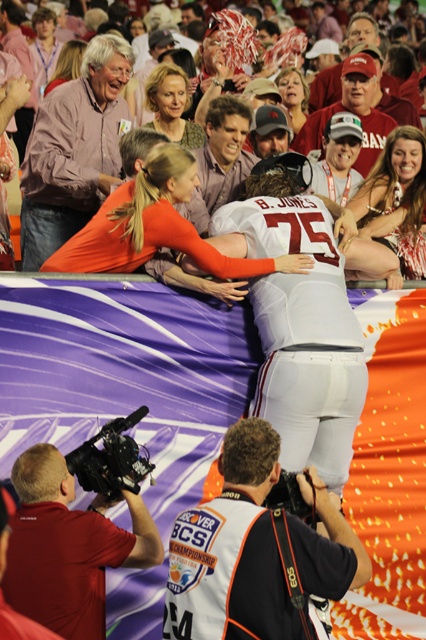
You are a photographer at the BCS Championship game. You notice a matte black camera at lower left and a matte orange jersey at center. Which object is positioned lower in the image?

The matte black camera at lower left is located below the matte orange jersey at center, so it is positioned lower in the image.

You are a photographer at the event and need to capture a closeup shot of the white fabric jersey at upper center without the matte black camera at lower left appearing in the frame. Given their sizes, is this possible?

The white fabric jersey at upper center is larger in size than the matte black camera at lower left. Since the jersey is bigger, it can potentially block the camera from view if positioned correctly, making it possible to capture a closeup without the camera appearing in the frame.

You are a photographer at the event and want to capture the player wearing the white jersey with the number 75 and the name B. JONES on the back. You notice a specific point marked at coordinates (253, 550). Based on the scene description, where is this point located relative to the player?

The point at coordinates (253, 550) is located on the white fabric jersey at upper center of the player.